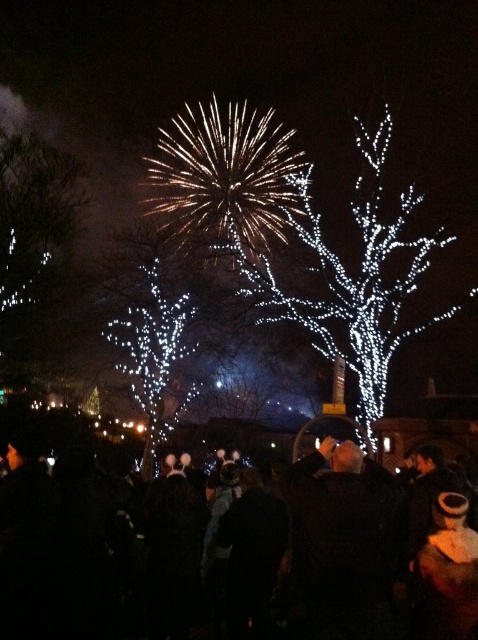
Question: Which point appears closest to the camera in this image?

Choices:
 (A) (98, 600)
 (B) (366, 420)

Answer: (A)

Question: Does black fabric crowd at center appear on the left side of illuminated white tree at center?

Choices:
 (A) no
 (B) yes

Answer: (B)

Question: Considering the relative positions of black fabric crowd at center and illuminated white tree at center in the image provided, where is black fabric crowd at center located with respect to illuminated white tree at center?

Choices:
 (A) right
 (B) left

Answer: (B)

Question: Among these points, which one is farthest from the camera?

Choices:
 (A) (362, 337)
 (B) (0, 490)

Answer: (A)

Question: Can you confirm if black fabric crowd at center is positioned to the left of illuminated white tree at center?

Choices:
 (A) yes
 (B) no

Answer: (A)